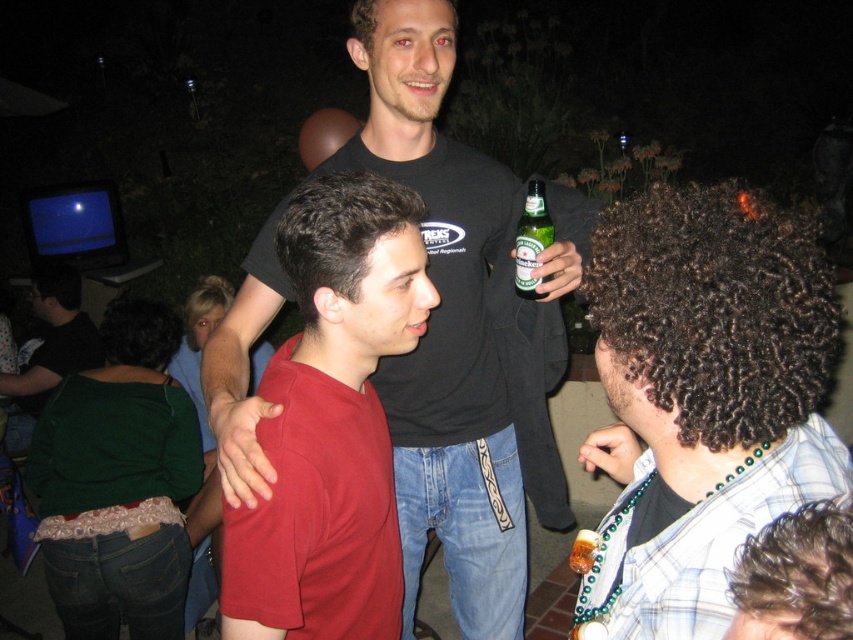
Question: Estimate the real-world distances between objects in this image. Which object is closer to the translucent glass bottle at center?

Choices:
 (A) green glass bottle at center
 (B) matte black shirt at center
 (C) matte red shirt at center

Answer: (C)

Question: Which point is closer to the camera?

Choices:
 (A) (523, 234)
 (B) (302, 468)
 (C) (584, 548)

Answer: (C)

Question: Which object is farther from the camera taking this photo?

Choices:
 (A) matte black shirt at center
 (B) matte red shirt at center

Answer: (B)

Question: Does matte red shirt at center appear under green glass bottle at center?

Choices:
 (A) no
 (B) yes

Answer: (B)

Question: Does green glass bottle at center have a greater width compared to translucent glass bottle at center?

Choices:
 (A) yes
 (B) no

Answer: (A)

Question: From the image, what is the correct spatial relationship of matte red shirt at center in relation to translucent glass bottle at center?

Choices:
 (A) right
 (B) left

Answer: (B)